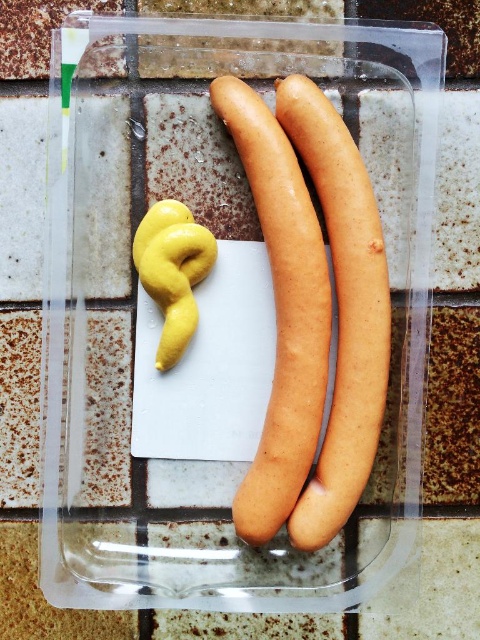
Question: Is smooth beige sausage at center to the left of smooth beige hot dog at center from the viewer's perspective?

Choices:
 (A) yes
 (B) no

Answer: (A)

Question: Where is smooth beige sausage at center located in relation to smooth beige hot dog at center in the image?

Choices:
 (A) left
 (B) right

Answer: (A)

Question: Does smooth beige sausage at center appear on the left side of smooth beige hot dog at center?

Choices:
 (A) no
 (B) yes

Answer: (B)

Question: Which point is closer to the camera?

Choices:
 (A) (314, 337)
 (B) (384, 307)

Answer: (A)